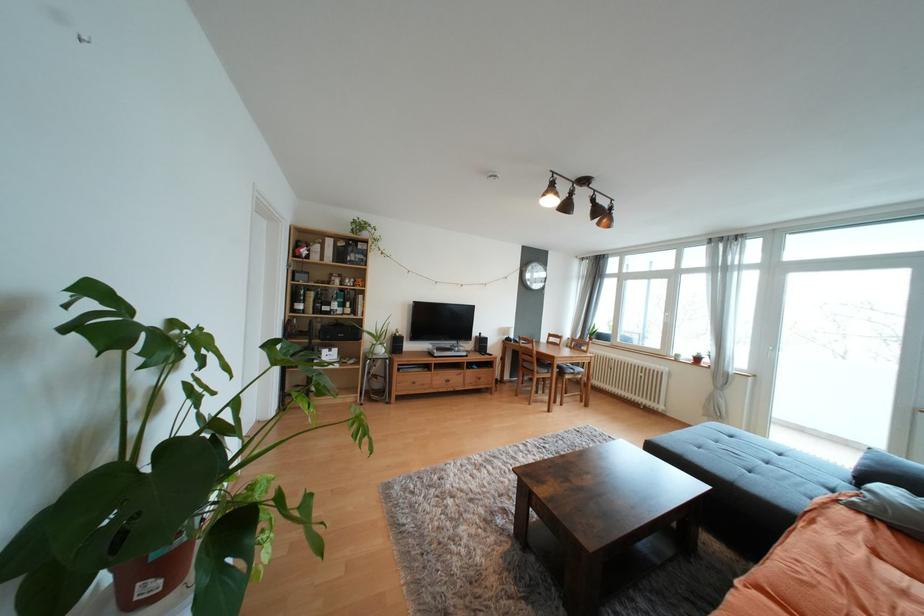
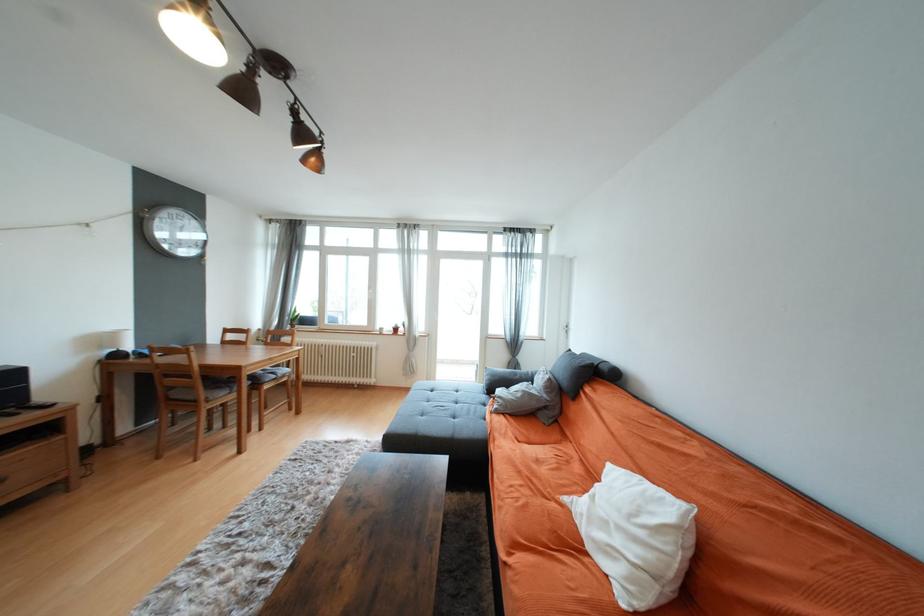
Where in the second image is the point corresponding to pixel 792 479 from the first image?

(475, 411)